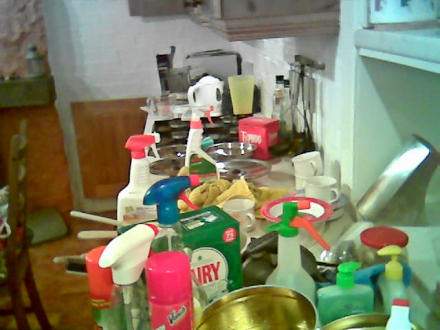
You are a GUI agent. You are given a task and a screenshot of the screen. Output one action in this format:
    pyautogui.click(x=<x>, y=<y>)
    Task: Click on the bottle
    The image size is (440, 330).
    Given the screenshot: What is the action you would take?
    pyautogui.click(x=174, y=238)